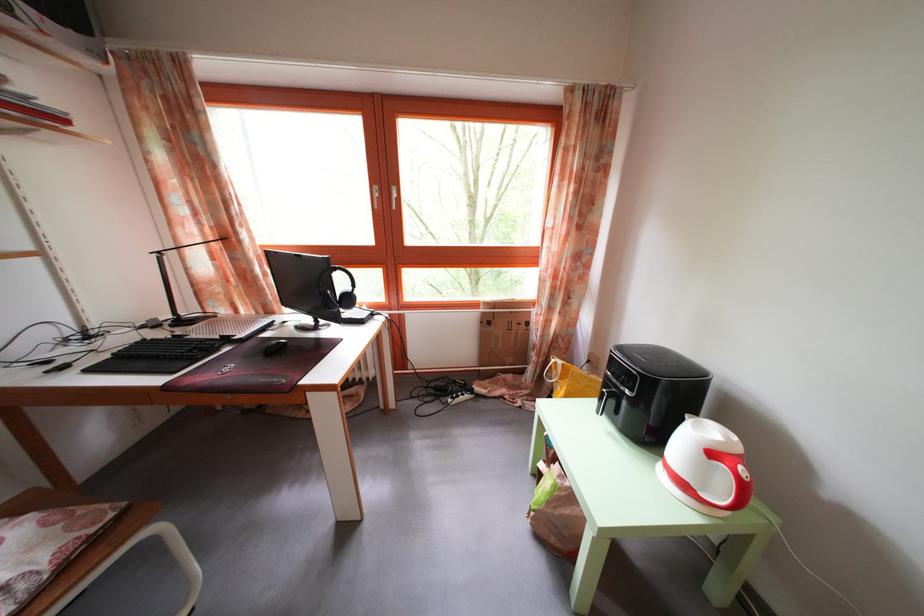
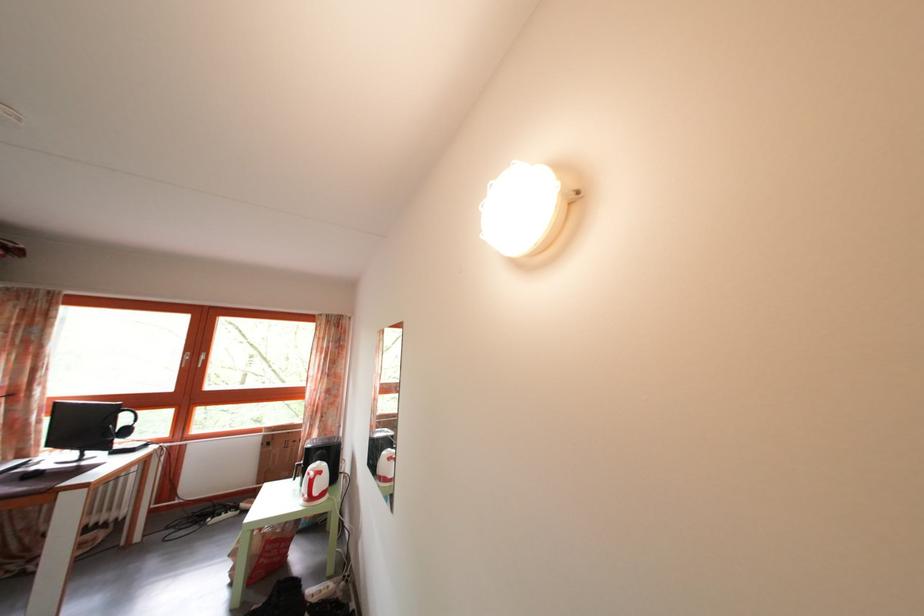
Locate, in the second image, the point that corresponds to point (555, 329) in the first image.

(317, 442)